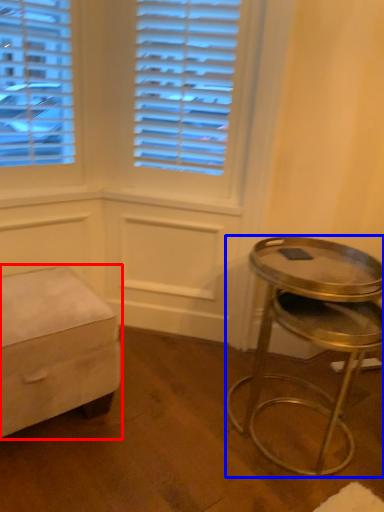
Question: Which object is closer to the camera taking this photo, furniture (highlighted by a red box) or stool (highlighted by a blue box)?

Choices:
 (A) furniture
 (B) stool

Answer: (B)